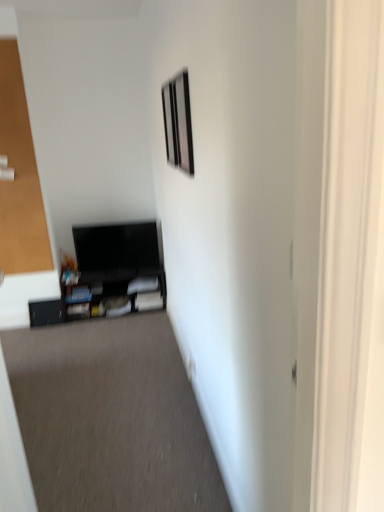
Question: Does matte black picture frame at upper center, the 1th picture frame from the back, appear on the right side of matte black entertainment center at lower left?

Choices:
 (A) yes
 (B) no

Answer: (A)

Question: From a real-world perspective, is matte black picture frame at upper center, the 1th picture frame from the back, physically above matte black entertainment center at lower left?

Choices:
 (A) no
 (B) yes

Answer: (B)

Question: Is matte black picture frame at upper center, the 1th picture frame from the back, positioned beyond the bounds of matte black entertainment center at lower left?

Choices:
 (A) yes
 (B) no

Answer: (A)

Question: Could you tell me if matte black picture frame at upper center, the second picture frame when ordered from right to left, is facing matte black entertainment center at lower left?

Choices:
 (A) yes
 (B) no

Answer: (B)

Question: Is matte black picture frame at upper center, which is the second picture frame in front-to-back order, bigger than matte black entertainment center at lower left?

Choices:
 (A) yes
 (B) no

Answer: (B)

Question: Can you confirm if matte black picture frame at upper center, the 1th picture frame from the back, is wider than matte black entertainment center at lower left?

Choices:
 (A) yes
 (B) no

Answer: (B)

Question: Is matte black entertainment center at lower left to the left of transparent glass door at left from the viewer's perspective?

Choices:
 (A) yes
 (B) no

Answer: (B)

Question: Is matte black entertainment center at lower left positioned behind transparent glass door at left?

Choices:
 (A) no
 (B) yes

Answer: (B)

Question: Is matte black entertainment center at lower left shorter than transparent glass door at left?

Choices:
 (A) yes
 (B) no

Answer: (A)

Question: From a real-world perspective, does matte black entertainment center at lower left stand above transparent glass door at left?

Choices:
 (A) no
 (B) yes

Answer: (A)

Question: From the image's perspective, is matte black entertainment center at lower left located beneath transparent glass door at left?

Choices:
 (A) yes
 (B) no

Answer: (A)

Question: Can you confirm if matte black entertainment center at lower left is thinner than transparent glass door at left?

Choices:
 (A) yes
 (B) no

Answer: (B)

Question: Is metallic silver picture frame at upper center, which is counted as the first picture frame, starting from the right, positioned behind transparent glass door at left?

Choices:
 (A) yes
 (B) no

Answer: (B)